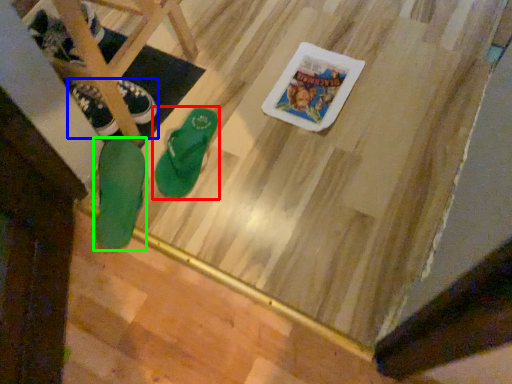
Question: Which object is the closest to the footwear (highlighted by a red box)? Choose among these: footwear (highlighted by a blue box) or footwear (highlighted by a green box).

Choices:
 (A) footwear
 (B) footwear

Answer: (B)